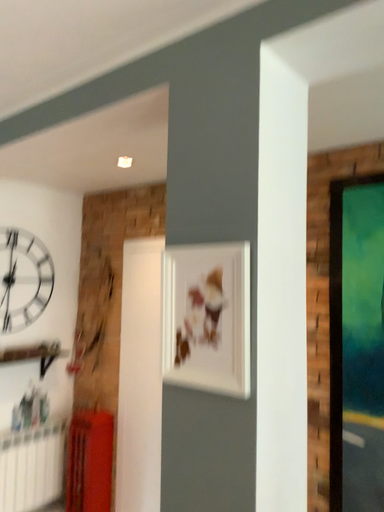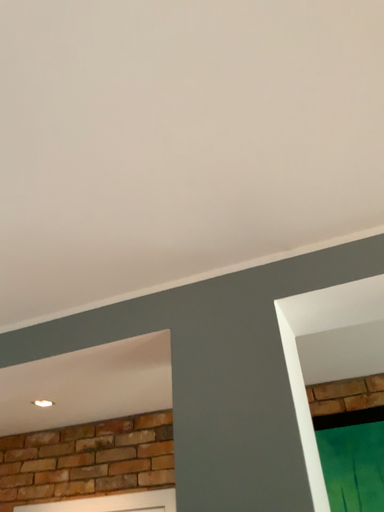
Question: Which way did the camera rotate in the video?

Choices:
 (A) rotated downward
 (B) rotated upward

Answer: (B)